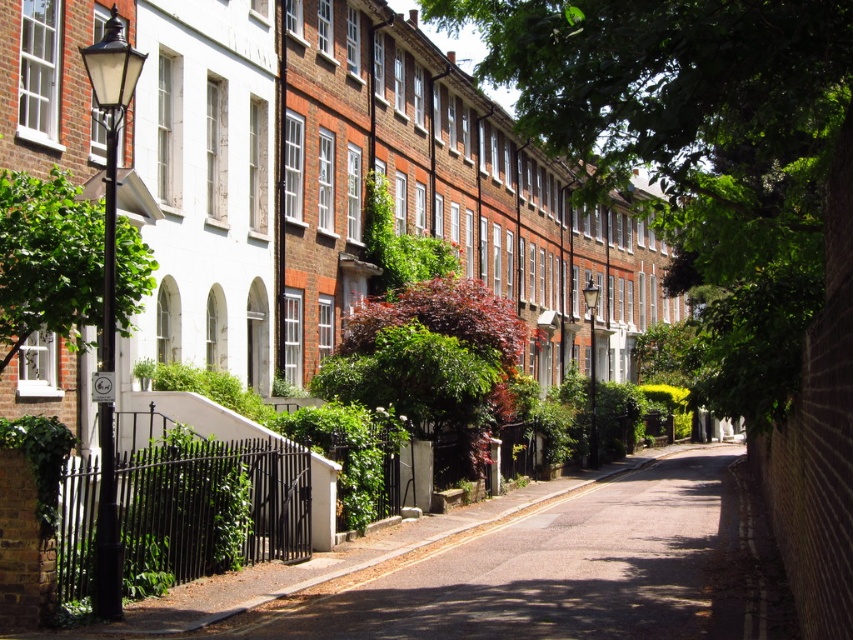
Which is more to the right, green leafy tree at center or smooth asphalt road at center?

green leafy tree at center

Looking at this image, is green leafy tree at center bigger than smooth asphalt road at center?

Indeed, green leafy tree at center has a larger size compared to smooth asphalt road at center.

Is point (694, 180) positioned after point (641, 541)?

No, it is not.

This screenshot has width=853, height=640. What are the coordinates of `green leafy tree at center` in the screenshot? It's located at (701, 150).

Does point (819, 92) come farther from viewer compared to point (74, 298)?

That is False.

Which is behind, point (817, 230) or point (59, 172)?

Point (817, 230)

Identify the location of green leafy tree at center. (701, 150).

Find the location of a particular element. The height and width of the screenshot is (640, 853). smooth asphalt road at center is located at coordinates (558, 570).

The width and height of the screenshot is (853, 640). Identify the location of smooth asphalt road at center. (558, 570).